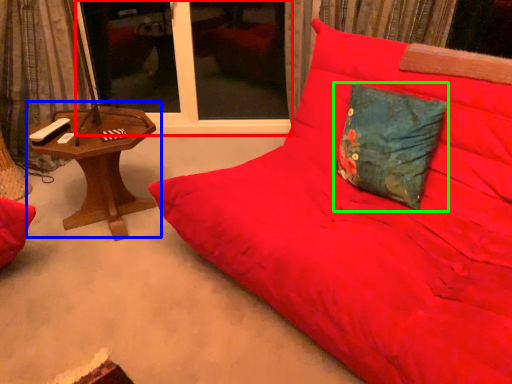
Question: Estimate the real-world distances between objects in this image. Which object is farther from window screen (highlighted by a red box), table (highlighted by a blue box) or pillow (highlighted by a green box)?

Choices:
 (A) table
 (B) pillow

Answer: (B)